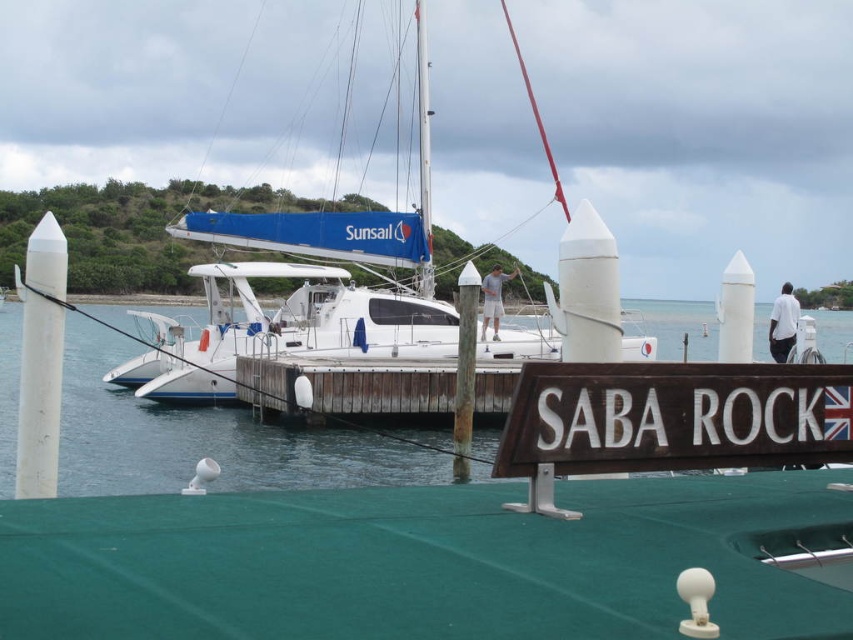
You are a photographer planning to capture the white glossy catamaran at center and the brown wooden sign at lower center in a single shot. Which object will appear taller in the photo?

The white glossy catamaran at center will appear taller in the photo because it has a greater height compared to the brown wooden sign at lower center.

You are a dock worker who needs to secure the white glossy catamaran at center to the pier. The safety regulations state that the distance between the boat and the pier must be less than 8 meters to ensure stability. Is the current distance compliant with the regulations?

The distance between the white glossy catamaran at center and the pier is 8.79 meters, which exceeds the 8 meters required by safety regulations. Therefore, the current distance is not compliant with the regulations.

You are standing on the pier at the marina and want to know the exact location of the clear blue water in the image. According to the coordinates provided, where is the clear blue water at center located?

The clear blue water at center is located at point coordinates of (202,438).